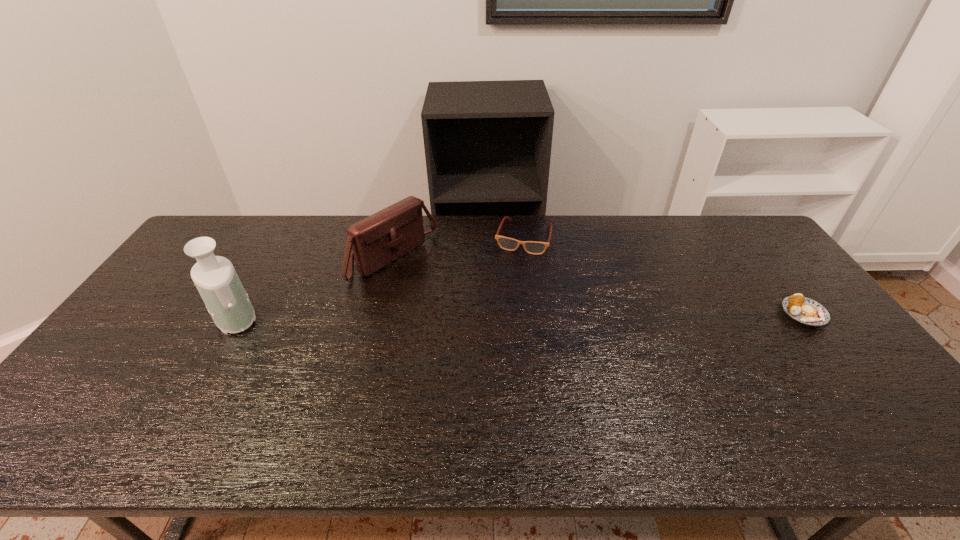
Where is `juicer`? This screenshot has width=960, height=540. juicer is located at coordinates (215, 278).

Locate an element on the screen. Image resolution: width=960 pixels, height=540 pixels. the tallest object is located at coordinates (215, 278).

Locate an element on the screen. pastry is located at coordinates (805, 310).

Where is `the rightmost object`? the rightmost object is located at coordinates (805, 310).

Where is `the second object from left to right`? The width and height of the screenshot is (960, 540). the second object from left to right is located at coordinates (377, 240).

Where is `shoulder bag`? This screenshot has height=540, width=960. shoulder bag is located at coordinates (377, 240).

Where is `spectacles`? spectacles is located at coordinates (532, 247).

Image resolution: width=960 pixels, height=540 pixels. Find the location of `the second object from right to left`. the second object from right to left is located at coordinates (532, 247).

Locate an element on the screen. free space located 0.140m on the right of the juicer is located at coordinates (307, 316).

Image resolution: width=960 pixels, height=540 pixels. Identify the location of blank space located 0.070m on the back of the rightmost object. (780, 283).